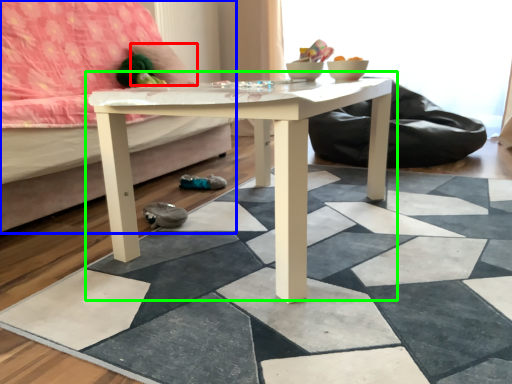
Question: Which object is positioned farthest from pillow (highlighted by a red box)? Select from studio couch (highlighted by a blue box) and coffee table (highlighted by a green box).

Choices:
 (A) studio couch
 (B) coffee table

Answer: (B)